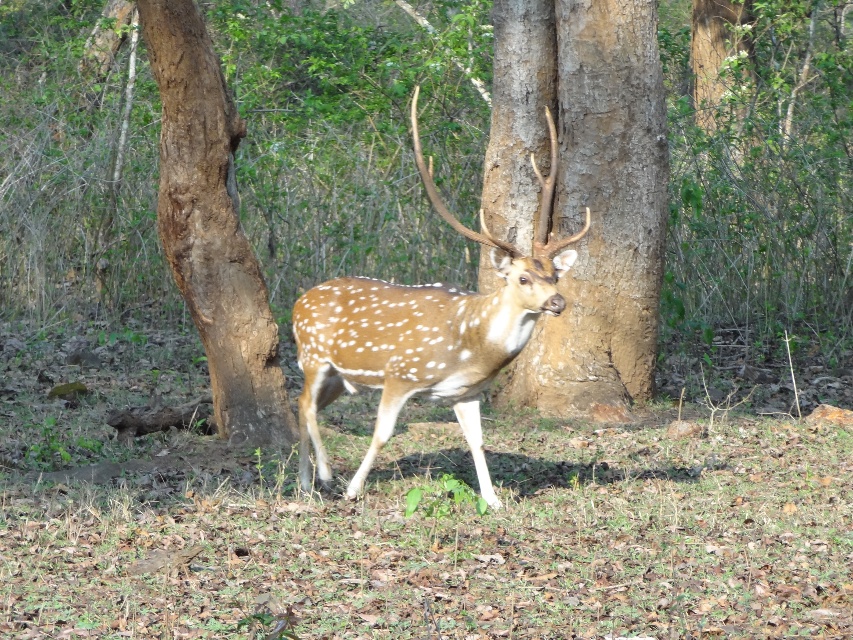
Can you confirm if brown rough tree trunk at center is positioned to the right of spotted fur deer at center?

Correct, you'll find brown rough tree trunk at center to the right of spotted fur deer at center.

What are the coordinates of `brown rough tree trunk at center` in the screenshot? It's located at (583, 189).

Identify the location of brown rough tree trunk at center. (583, 189).

Can you confirm if spotted fur deer at center is positioned below brown rough bark at left?

Yes, spotted fur deer at center is below brown rough bark at left.

Who is higher up, spotted fur deer at center or brown rough bark at left?

brown rough bark at left is higher up.

What do you see at coordinates (424, 332) in the screenshot? This screenshot has width=853, height=640. I see `spotted fur deer at center` at bounding box center [424, 332].

You are a GUI agent. You are given a task and a screenshot of the screen. Output one action in this format:
    pyautogui.click(x=<x>, y=<y>)
    Task: Click on the spotted fur deer at center
    The height and width of the screenshot is (640, 853).
    Given the screenshot: What is the action you would take?
    pyautogui.click(x=424, y=332)

Can you confirm if brown rough tree trunk at center is shorter than brown rough bark at left?

Incorrect, brown rough tree trunk at center's height does not fall short of brown rough bark at left's.

Which is above, brown rough tree trunk at center or brown rough bark at left?

brown rough tree trunk at center is higher up.

Identify the location of brown rough tree trunk at center. (583, 189).